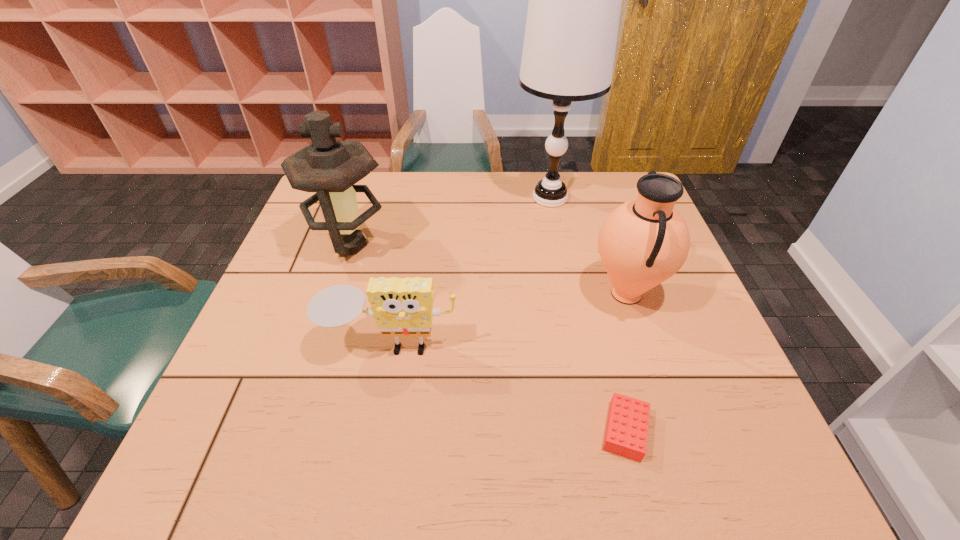
Find the location of a particular element. free space at the far left corner is located at coordinates (309, 210).

Identify the location of free space at the near left corner of the desktop. The image size is (960, 540). (236, 483).

The height and width of the screenshot is (540, 960). What are the coordinates of `vacant space at the far right corner of the desktop` in the screenshot? It's located at (621, 199).

In the image, there is a desktop. Where is `vacant space at the near right corner`? This screenshot has height=540, width=960. vacant space at the near right corner is located at coordinates (686, 456).

The height and width of the screenshot is (540, 960). I want to click on free point between the pitcher and the fourth tallest object, so click(x=509, y=320).

Where is `vacant point located between the second shortest object and the shortest object`? vacant point located between the second shortest object and the shortest object is located at coordinates (508, 388).

Locate an element on the screen. This screenshot has height=540, width=960. unoccupied area between the second shortest object and the third shortest object is located at coordinates (509, 320).

The width and height of the screenshot is (960, 540). Find the location of `free space that is in between the nearest object and the pitcher`. free space that is in between the nearest object and the pitcher is located at coordinates (626, 362).

Where is `free space between the fourth tallest object and the pitcher`? free space between the fourth tallest object and the pitcher is located at coordinates (509, 320).

Where is `vacant area that lies between the sponge and the table lamp`? vacant area that lies between the sponge and the table lamp is located at coordinates (470, 272).